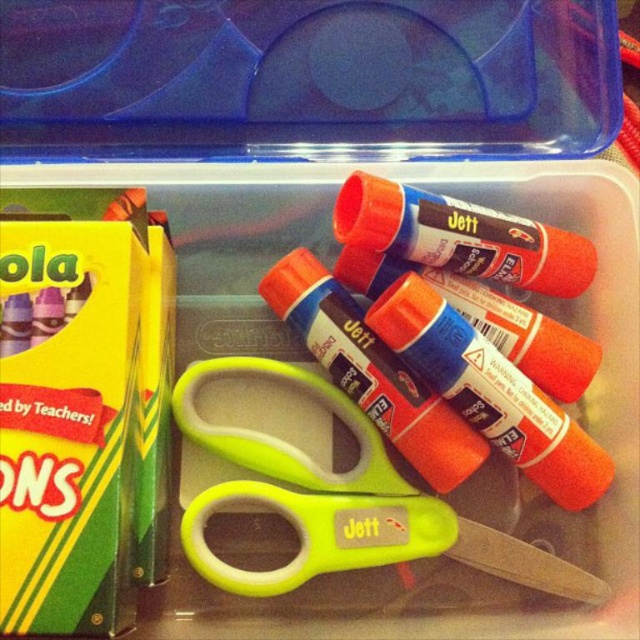
Question: Which of the following is the closest to the observer?

Choices:
 (A) (371, 177)
 (B) (269, 276)
 (C) (253, 577)
 (D) (538, 456)

Answer: (D)

Question: Is green plastic scissors at center smaller than matte black glue stick at center?

Choices:
 (A) yes
 (B) no

Answer: (B)

Question: In this image, where is green plastic scissors at center located relative to matte orange glue stick at center?

Choices:
 (A) left
 (B) right

Answer: (A)

Question: Is matte plastic glue sticks at center above matte black glue stick at center?

Choices:
 (A) yes
 (B) no

Answer: (B)

Question: Which point is closer to the camera taking this photo?

Choices:
 (A) (348, 237)
 (B) (298, 556)

Answer: (A)

Question: Which point is farther from the camera taking this photo?

Choices:
 (A) (412, 189)
 (B) (280, 307)
 (C) (268, 484)

Answer: (B)